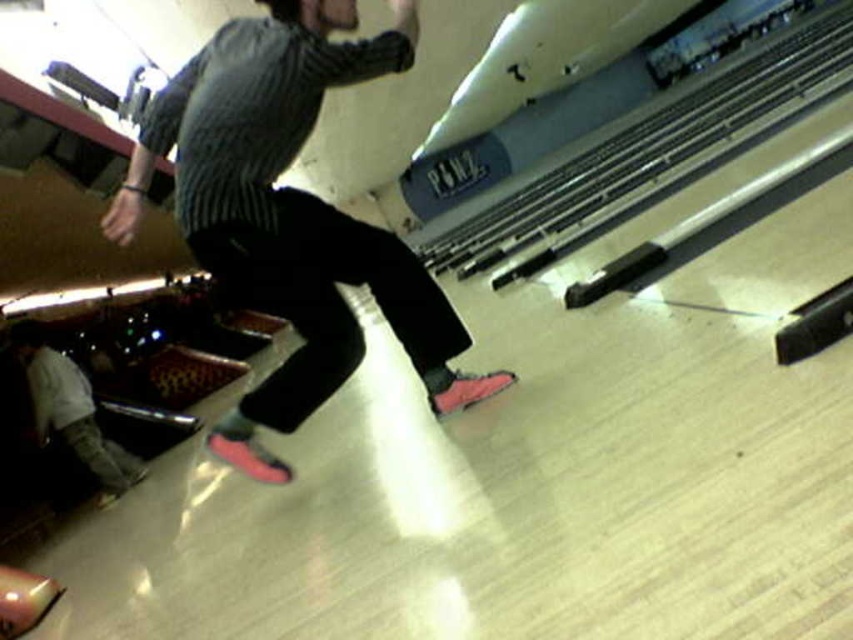
Is point (270, 65) more distant than point (30, 353)?

No, it is in front of (30, 353).

Between pink suede sneakers at center and camouflage pants at lower left, which one is positioned lower?

camouflage pants at lower left is below.

Does point (144, 134) come farther from viewer compared to point (115, 451)?

That is False.

At what (x,y) coordinates should I click in order to perform the action: click on pink suede sneakers at center. Please return your answer as a coordinate pair (x, y). Looking at the image, I should click on (289, 212).